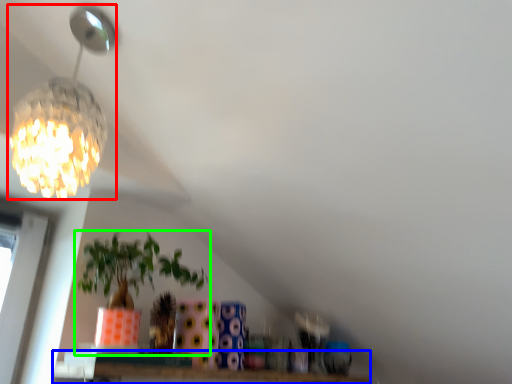
Question: Which is farther away from lamp (highlighted by a red box)? window (highlighted by a blue box) or houseplant (highlighted by a green box)?

Choices:
 (A) window
 (B) houseplant

Answer: (A)